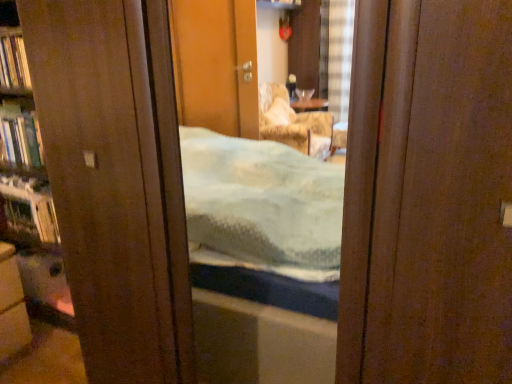
Measure the distance between point (46, 241) and camera.

The depth of point (46, 241) is 7.01 feet.

What do you see at coordinates (20, 137) in the screenshot?
I see `hardcover book at left, marked as the 1th book in a bottom-to-top arrangement` at bounding box center [20, 137].

Where is `metallic silver shelf at left`? metallic silver shelf at left is located at coordinates (30, 210).

Considering the relative sizes of hardcover book at left, acting as the 2th book starting from the top, and hardcover book at left, the 1th book from the top, in the image provided, is hardcover book at left, acting as the 2th book starting from the top, bigger than hardcover book at left, the 1th book from the top,?

No.

Which object is further away from the camera, hardcover book at left, marked as the 1th book in a bottom-to-top arrangement, or hardcover book at left, the 1th book from the top?

hardcover book at left, marked as the 1th book in a bottom-to-top arrangement, is behind.

Is hardcover book at left, marked as the 1th book in a bottom-to-top arrangement, shorter than hardcover book at left, the 1th book from the top?

Yes.

Considering the sizes of hardcover book at left, marked as the 1th book in a bottom-to-top arrangement, and hardcover book at left, the second book ordered from the bottom, in the image, is hardcover book at left, marked as the 1th book in a bottom-to-top arrangement, wider or thinner than hardcover book at left, the second book ordered from the bottom,?

Clearly, hardcover book at left, marked as the 1th book in a bottom-to-top arrangement, has more width compared to hardcover book at left, the second book ordered from the bottom.

From a real-world perspective, who is located lower, matte brown cabinet at lower left or metallic silver shelf at left?

matte brown cabinet at lower left, from a real-world perspective.

How different are the orientations of matte brown cabinet at lower left and metallic silver shelf at left in degrees?

The facing directions of matte brown cabinet at lower left and metallic silver shelf at left are 90.2 degrees apart.

Is matte brown cabinet at lower left in contact with metallic silver shelf at left?

No, matte brown cabinet at lower left is not with metallic silver shelf at left.

Is matte brown cabinet at lower left oriented towards metallic silver shelf at left?

No, matte brown cabinet at lower left does not turn towards metallic silver shelf at left.

Locate an element on the screen. This screenshot has width=512, height=384. shelf that is on the right side of hardcover book at left, marked as the 1th book in a bottom-to-top arrangement is located at coordinates click(30, 210).

Consider the image. Which of these two, hardcover book at left, acting as the 2th book starting from the top, or metallic silver shelf at left, is smaller?

With smaller size is hardcover book at left, acting as the 2th book starting from the top.

Is hardcover book at left, acting as the 2th book starting from the top, far away from metallic silver shelf at left?

hardcover book at left, acting as the 2th book starting from the top, is actually quite close to metallic silver shelf at left.

Which is behind, hardcover book at left, marked as the 1th book in a bottom-to-top arrangement, or metallic silver shelf at left?

Answer: metallic silver shelf at left is further from the camera.

Based on the photo, is metallic silver shelf at left spatially inside hardcover book at left, the second book ordered from the bottom, or outside of it?

metallic silver shelf at left is located beyond the bounds of hardcover book at left, the second book ordered from the bottom.

Between metallic silver shelf at left and hardcover book at left, the 1th book from the top, which one appears on the left side from the viewer's perspective?

From the viewer's perspective, hardcover book at left, the 1th book from the top, appears more on the left side.

Based on the photo, which of these two, metallic silver shelf at left or hardcover book at left, the second book ordered from the bottom, is smaller?

hardcover book at left, the second book ordered from the bottom.

Is metallic silver shelf at left beside hardcover book at left, the 1th book from the top?

No, metallic silver shelf at left is not in contact with hardcover book at left, the 1th book from the top.

Does matte brown cabinet at lower left have a smaller size compared to hardcover book at left, acting as the 2th book starting from the top?

No.

Between point (24, 331) and point (13, 140), which one is positioned behind?

The point (13, 140) is farther.

Could you measure the distance between matte brown cabinet at lower left and hardcover book at left, acting as the 2th book starting from the top?

The distance of matte brown cabinet at lower left from hardcover book at left, acting as the 2th book starting from the top, is 23.81 inches.

This screenshot has width=512, height=384. There is a matte brown cabinet at lower left. Identify the location of the 1st book above it (from the image's perspective). [x=20, y=137].

Is matte brown cabinet at lower left in front of or behind hardcover book at left, the 1th book from the top, in the image?

Clearly, matte brown cabinet at lower left is in front of hardcover book at left, the 1th book from the top.

Considering the positions of objects matte brown cabinet at lower left and hardcover book at left, the second book ordered from the bottom, in the image provided, who is more to the right, matte brown cabinet at lower left or hardcover book at left, the second book ordered from the bottom,?

matte brown cabinet at lower left is more to the right.

Is matte brown cabinet at lower left bigger than hardcover book at left, the second book ordered from the bottom?

Indeed, matte brown cabinet at lower left has a larger size compared to hardcover book at left, the second book ordered from the bottom.

Considering the points (5, 319) and (1, 83), which point is in front, point (5, 319) or point (1, 83)?

The point (5, 319) is more forward.

Is metallic silver shelf at left far away from hardcover book at left, acting as the 2th book starting from the top?

No, metallic silver shelf at left is not far from hardcover book at left, acting as the 2th book starting from the top.

From the image's perspective, is metallic silver shelf at left over hardcover book at left, acting as the 2th book starting from the top?

No.

Looking at this image, can you confirm if metallic silver shelf at left is thinner than hardcover book at left, marked as the 1th book in a bottom-to-top arrangement?

Incorrect, the width of metallic silver shelf at left is not less than that of hardcover book at left, marked as the 1th book in a bottom-to-top arrangement.

From the picture: From a real-world perspective, who is located lower, metallic silver shelf at left or hardcover book at left, acting as the 2th book starting from the top?

metallic silver shelf at left, from a real-world perspective.

This screenshot has height=384, width=512. Find the location of `book that is in front of the hardcover book at left, marked as the 1th book in a bottom-to-top arrangement`. book that is in front of the hardcover book at left, marked as the 1th book in a bottom-to-top arrangement is located at coordinates pyautogui.click(x=13, y=60).

In order to click on shelf above the matte brown cabinet at lower left (from the image's perspective) in this screenshot , I will do `click(30, 210)`.

When comparing their distances from hardcover book at left, acting as the 2th book starting from the top, does metallic silver shelf at left or hardcover book at left, the second book ordered from the bottom, seem closer?

The object closer to hardcover book at left, acting as the 2th book starting from the top, is metallic silver shelf at left.

From the image, which object appears to be farther from hardcover book at left, marked as the 1th book in a bottom-to-top arrangement, matte brown cabinet at lower left or hardcover book at left, the 1th book from the top?

Among the two, matte brown cabinet at lower left is located further to hardcover book at left, marked as the 1th book in a bottom-to-top arrangement.

Based on their spatial positions, is hardcover book at left, marked as the 1th book in a bottom-to-top arrangement, or matte brown cabinet at lower left further from metallic silver shelf at left?

Among the two, matte brown cabinet at lower left is located further to metallic silver shelf at left.

Considering their positions, is hardcover book at left, marked as the 1th book in a bottom-to-top arrangement, positioned further to hardcover book at left, the second book ordered from the bottom, than metallic silver shelf at left?

The object further to hardcover book at left, the second book ordered from the bottom, is metallic silver shelf at left.

Looking at the image, which one is located further to hardcover book at left, marked as the 1th book in a bottom-to-top arrangement, hardcover book at left, the 1th book from the top, or metallic silver shelf at left?

hardcover book at left, the 1th book from the top, is positioned further to the anchor hardcover book at left, marked as the 1th book in a bottom-to-top arrangement.

Considering their positions, is matte brown cabinet at lower left positioned closer to hardcover book at left, the second book ordered from the bottom, than metallic silver shelf at left?

Based on the image, metallic silver shelf at left appears to be nearer to hardcover book at left, the second book ordered from the bottom.

When comparing their distances from metallic silver shelf at left, does hardcover book at left, the 1th book from the top, or hardcover book at left, marked as the 1th book in a bottom-to-top arrangement, seem further?

hardcover book at left, the 1th book from the top.

Based on their spatial positions, is metallic silver shelf at left or matte brown cabinet at lower left closer to hardcover book at left, marked as the 1th book in a bottom-to-top arrangement?

The object closer to hardcover book at left, marked as the 1th book in a bottom-to-top arrangement, is metallic silver shelf at left.

You are a GUI agent. You are given a task and a screenshot of the screen. Output one action in this format:
    pyautogui.click(x=<x>, y=<y>)
    Task: Click on the shelf between hardcover book at left, marked as the 1th book in a bottom-to-top arrangement, and matte brown cabinet at lower left from top to bottom
    The width and height of the screenshot is (512, 384).
    Given the screenshot: What is the action you would take?
    pyautogui.click(x=30, y=210)

Locate an element on the screen. book between hardcover book at left, the second book ordered from the bottom, and metallic silver shelf at left, in the vertical direction is located at coordinates (20, 137).

The image size is (512, 384). Identify the location of book between hardcover book at left, the 1th book from the top, and matte brown cabinet at lower left from top to bottom. (20, 137).

I want to click on shelf between hardcover book at left, the 1th book from the top, and matte brown cabinet at lower left vertically, so click(30, 210).